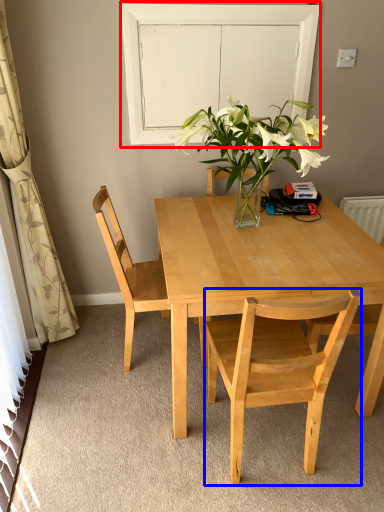
Question: Which of the following is the farthest to the observer, glass door (highlighted by a red box) or chair (highlighted by a blue box)?

Choices:
 (A) glass door
 (B) chair

Answer: (A)